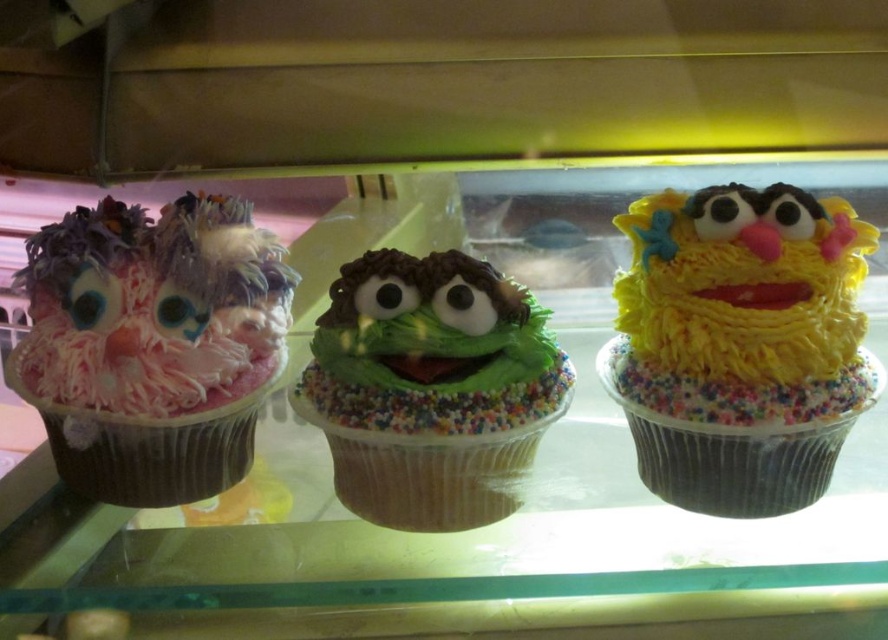
You are a customer at the bakery and want to choose a cupcake that is taller than the others. Which one should you pick between the yellow frosting cupcake at center and the pink fluffy cupcake at left?

The yellow frosting cupcake at center is much taller than the pink fluffy cupcake at left, so you should pick the yellow frosting cupcake at center.

You are a customer at the bakery and want to take a photo of both the cupcake at point (807,504) and the cupcake at point (347,300). Which cupcake should you focus on first to ensure both are in clear view?

You should focus on the cupcake at point (807,504) first because it is closer to the camera than the cupcake at point (347,300). By focusing on the closer cupcake, both will be in clear view as the farther one will still be within the depth of field.

You are a customer at the bakery and want to take a photo of both the pink fluffy cupcake at left and the green frosted cupcake at center without any obstruction. Based on their positions, which cupcake should you focus on first to ensure both are in the frame?

The pink fluffy cupcake at left is closer to the viewer than the green frosted cupcake at center. To ensure both are in the frame without obstruction, focus on the pink fluffy cupcake at left first, as it is closer and will be in the foreground, allowing the green frosted cupcake at center to be visible behind it.